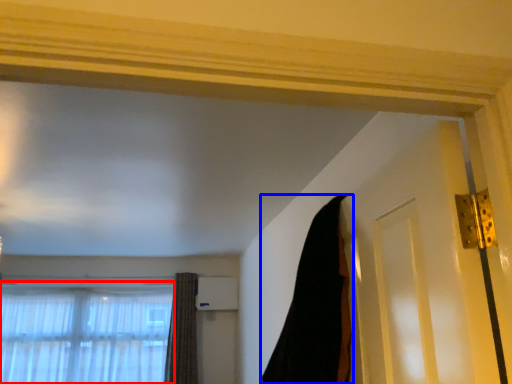
Question: Which object is further to the camera taking this photo, window (highlighted by a red box) or curtain (highlighted by a blue box)?

Choices:
 (A) window
 (B) curtain

Answer: (A)